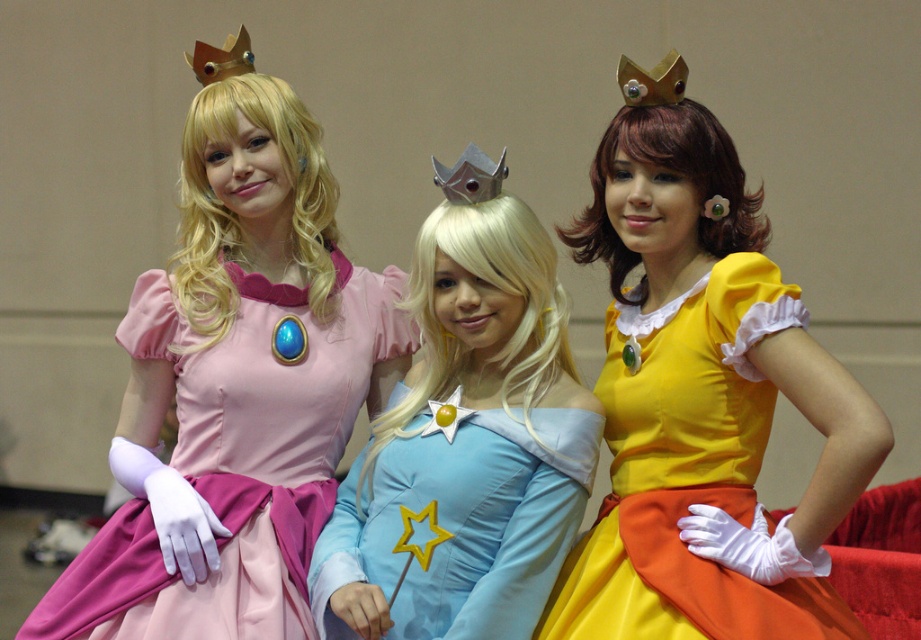
Question: Considering the relative positions of matte yellow dress at center and light blue satin dress at center in the image provided, where is matte yellow dress at center located with respect to light blue satin dress at center?

Choices:
 (A) right
 (B) left

Answer: (A)

Question: Is the position of matte yellow dress at center less distant than that of light blue satin dress at center?

Choices:
 (A) no
 (B) yes

Answer: (B)

Question: Which object is positioned closest to the matte yellow dress at center?

Choices:
 (A) light blue satin dress at center
 (B) matte pink fabric dress at left

Answer: (A)

Question: Observing the image, what is the correct spatial positioning of light blue satin dress at center in reference to matte pink fabric dress at left?

Choices:
 (A) left
 (B) right

Answer: (B)

Question: Considering the real-world distances, which object is farthest from the matte pink fabric dress at left?

Choices:
 (A) light blue satin dress at center
 (B) matte yellow dress at center

Answer: (B)

Question: Which point appears farthest from the camera in this image?

Choices:
 (A) (689, 168)
 (B) (243, 465)
 (C) (485, 484)

Answer: (B)